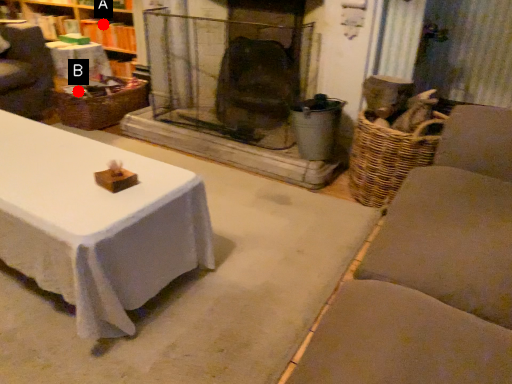
Question: Two points are circled on the image, labeled by A and B beside each circle. Which of the following is the closest to the observer?

Choices:
 (A) A is closer
 (B) B is closer

Answer: (B)